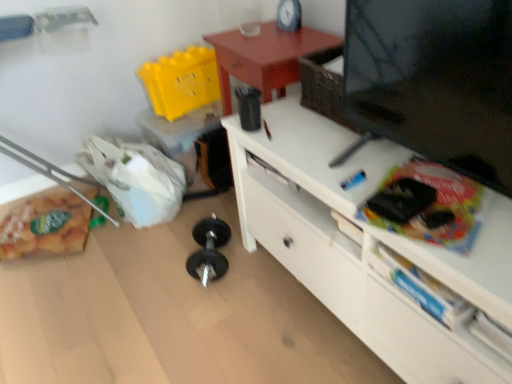
What is the approximate height of black matte tv at upper right?

It is 21.69 inches.

Where is `white matte drawer at lower right`? The height and width of the screenshot is (384, 512). white matte drawer at lower right is located at coordinates (420, 341).

Locate an element on the screen. The width and height of the screenshot is (512, 384). black matte tv at upper right is located at coordinates (366, 245).

Between translucent plastic bag at lower left and matte black clock at upper center, which one is positioned behind?

translucent plastic bag at lower left is further away from the camera.

Which of these two, translucent plastic bag at lower left or matte black clock at upper center, is smaller?

Smaller between the two is matte black clock at upper center.

Image resolution: width=512 pixels, height=384 pixels. I want to click on stuff on the left of the matte black clock at upper center, so click(45, 226).

From a real-world perspective, is matte black clock at upper center physically located above or below white matte drawer at lower right?

From a real-world perspective, matte black clock at upper center is physically above white matte drawer at lower right.

Considering the relative positions of matte black clock at upper center and white matte drawer at lower right in the image provided, is matte black clock at upper center to the right of white matte drawer at lower right from the viewer's perspective?

Incorrect, matte black clock at upper center is not on the right side of white matte drawer at lower right.

Which object is more forward, matte black clock at upper center or white matte drawer at lower right?

white matte drawer at lower right.

Based on the photo, from the image's perspective, between matte black clock at upper center and white matte drawer at lower right, which one is located above?

matte black clock at upper center.

Are black matte tv at upper right and matte black clock at upper center making contact?

They are not placed beside each other.

Is black matte tv at upper right positioned with its back to matte black clock at upper center?

No, black matte tv at upper right is not facing away from matte black clock at upper center.

Does black matte tv at upper right appear on the right side of matte black clock at upper center?

Yes.

Is black matte tv at upper right wider or thinner than matte black clock at upper center?

Considering their sizes, black matte tv at upper right looks broader than matte black clock at upper center.

Visually, is white matte drawer at lower right positioned to the left or to the right of matte black clock at upper center?

white matte drawer at lower right is to the right of matte black clock at upper center.

Could you tell me if white matte drawer at lower right is turned towards matte black clock at upper center?

No, white matte drawer at lower right is not facing towards matte black clock at upper center.

The height and width of the screenshot is (384, 512). I want to click on clock positioned vertically above the white matte drawer at lower right (from a real-world perspective), so click(289, 15).

Can you tell me how much white matte drawer at lower right and matte black clock at upper center differ in facing direction?

The angle between the facing direction of white matte drawer at lower right and the facing direction of matte black clock at upper center is 4.24 degrees.

From a real-world perspective, is matte black clock at upper center under black matte tv at upper right?

No, from a real-world perspective, matte black clock at upper center is not below black matte tv at upper right.

Looking at this image, which object is closer to the camera taking this photo, matte black clock at upper center or black matte tv at upper right?

black matte tv at upper right is in front.

From the image's perspective, which one is positioned higher, matte black clock at upper center or black matte tv at upper right?

matte black clock at upper center is shown above in the image.

Which of these two, matte black clock at upper center or black matte tv at upper right, is smaller?

matte black clock at upper center is smaller.

Does translucent plastic bag at lower left have a lesser width compared to black matte tv at upper right?

In fact, translucent plastic bag at lower left might be wider than black matte tv at upper right.

Looking at this image, from a real-world perspective, is translucent plastic bag at lower left located beneath black matte tv at upper right?

Yes, from a real-world perspective, translucent plastic bag at lower left is beneath black matte tv at upper right.

Is translucent plastic bag at lower left positioned before black matte tv at upper right?

No, it is behind black matte tv at upper right.

Consider the image. Is translucent plastic bag at lower left looking in the opposite direction of black matte tv at upper right?

No, black matte tv at upper right is not at the back of translucent plastic bag at lower left.

Can you confirm if translucent plastic bag at lower left is bigger than white matte drawer at lower right?

Yes, translucent plastic bag at lower left is bigger than white matte drawer at lower right.

Identify the location of drawer that is below the translucent plastic bag at lower left (from the image's perspective). (420, 341).

From the image's perspective, relative to white matte drawer at lower right, is translucent plastic bag at lower left above or below?

Based on their image positions, translucent plastic bag at lower left is located above white matte drawer at lower right.

Image resolution: width=512 pixels, height=384 pixels. In order to click on stuff lying below the matte black clock at upper center (from the image's perspective) in this screenshot , I will do coord(45,226).

At what (x,y) coordinates should I click in order to perform the action: click on drawer lying on the right of matte black clock at upper center. Please return your answer as a coordinate pair (x, y). Looking at the image, I should click on (420, 341).

Looking at the image, which one is located closer to matte black clock at upper center, translucent plastic bag at lower left or black matte tv at upper right?

black matte tv at upper right is positioned closer to the anchor matte black clock at upper center.

Estimate the real-world distances between objects in this image. Which object is closer to translucent plastic bag at lower left, matte black clock at upper center or white matte drawer at lower right?

Among the two, matte black clock at upper center is located nearer to translucent plastic bag at lower left.

Based on their spatial positions, is white matte drawer at lower right or matte black clock at upper center closer to translucent plastic bag at lower left?

Among the two, matte black clock at upper center is located nearer to translucent plastic bag at lower left.

Estimate the real-world distances between objects in this image. Which object is closer to white matte drawer at lower right, translucent plastic bag at lower left or matte black clock at upper center?

matte black clock at upper center is closer to white matte drawer at lower right.

Which object lies nearer to the anchor point white matte drawer at lower right, translucent plastic bag at lower left or black matte tv at upper right?

black matte tv at upper right is closer to white matte drawer at lower right.

Based on their spatial positions, is translucent plastic bag at lower left or white matte drawer at lower right further from matte black clock at upper center?

Among the two, translucent plastic bag at lower left is located further to matte black clock at upper center.

Considering their positions, is white matte drawer at lower right positioned closer to matte black clock at upper center than translucent plastic bag at lower left?

The object closer to matte black clock at upper center is white matte drawer at lower right.

Considering their positions, is black matte tv at upper right positioned further to translucent plastic bag at lower left than white matte drawer at lower right?

white matte drawer at lower right.

Locate an element on the screen. This screenshot has height=384, width=512. drawer between black matte tv at upper right and matte black clock at upper center along the z-axis is located at coordinates (420, 341).

I want to click on clock between translucent plastic bag at lower left and black matte tv at upper right in the horizontal direction, so click(x=289, y=15).

The image size is (512, 384). Find the location of `desk between translucent plastic bag at lower left and white matte drawer at lower right from left to right`. desk between translucent plastic bag at lower left and white matte drawer at lower right from left to right is located at coordinates (366, 245).

Find the location of a particular element. The height and width of the screenshot is (384, 512). clock situated between translucent plastic bag at lower left and white matte drawer at lower right from left to right is located at coordinates (289, 15).